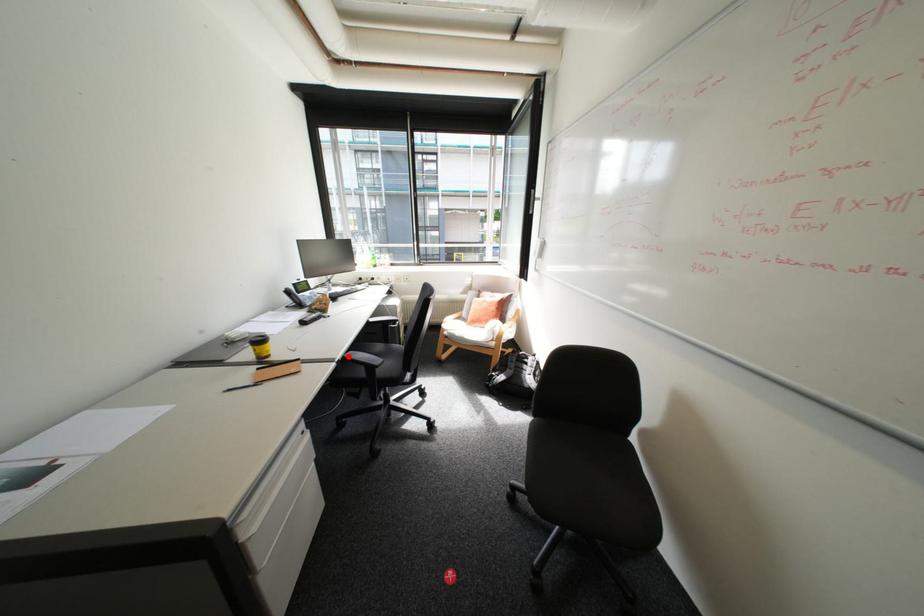
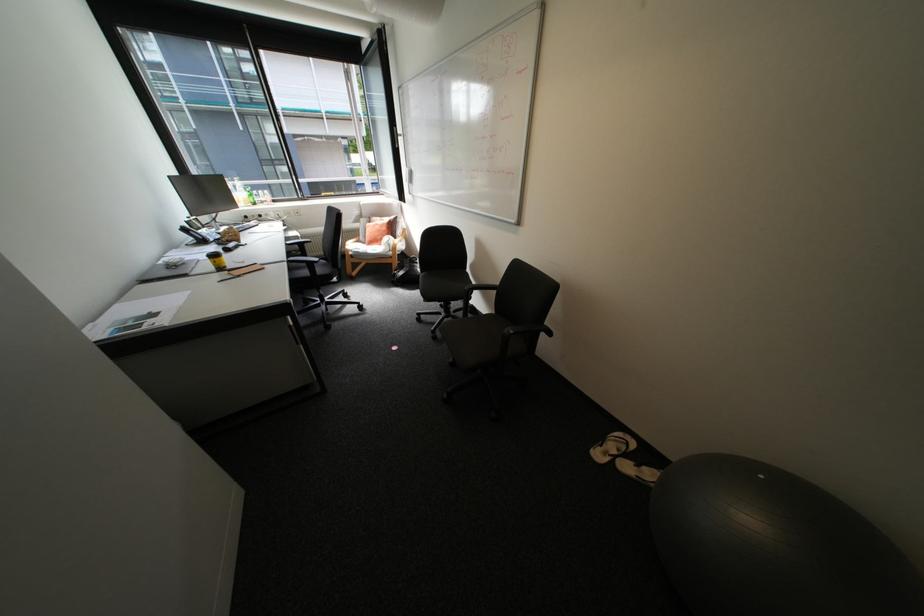
Locate, in the second image, the point that corresponds to the highlighted location in the first image.

(295, 259)